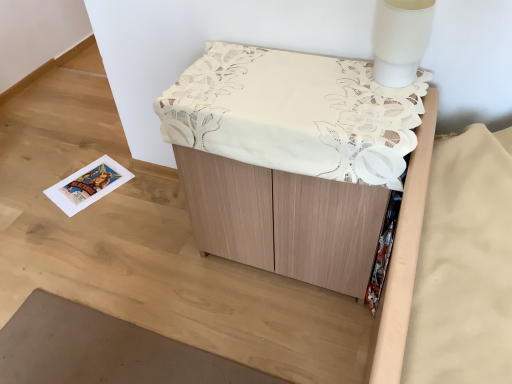
Identify the location of wooden cabinet at center. This screenshot has width=512, height=384. (304, 173).

Describe the element at coordinates (304, 173) in the screenshot. The width and height of the screenshot is (512, 384). I see `wooden cabinet at center` at that location.

You are a GUI agent. You are given a task and a screenshot of the screen. Output one action in this format:
    pyautogui.click(x=<x>, y=<y>)
    Task: Click on the white matte table lamp at upper right
    The image size is (512, 384).
    Given the screenshot: What is the action you would take?
    pyautogui.click(x=400, y=39)

The width and height of the screenshot is (512, 384). What do you see at coordinates (400, 39) in the screenshot?
I see `white matte table lamp at upper right` at bounding box center [400, 39].

The width and height of the screenshot is (512, 384). In order to click on wooden cabinet at center in this screenshot , I will do `click(304, 173)`.

Which object is positioned more to the left, white matte table lamp at upper right or wooden cabinet at center?

wooden cabinet at center is more to the left.

Relative to wooden cabinet at center, is white matte table lamp at upper right in front or behind?

white matte table lamp at upper right is positioned farther from the viewer than wooden cabinet at center.

Which is in front, point (409, 79) or point (256, 106)?

Point (256, 106)

From the image's perspective, between white matte table lamp at upper right and wooden cabinet at center, which one is located above?

white matte table lamp at upper right appears higher in the image.

From a real-world perspective, relative to wooden cabinet at center, is white matte table lamp at upper right vertically above or below?

Clearly, from a real-world perspective, white matte table lamp at upper right is above wooden cabinet at center.

Is white matte table lamp at upper right thinner than wooden cabinet at center?

Yes, white matte table lamp at upper right is thinner than wooden cabinet at center.

Who is shorter, white matte table lamp at upper right or wooden cabinet at center?

white matte table lamp at upper right is shorter.

Considering the sizes of white matte table lamp at upper right and wooden cabinet at center in the image, is white matte table lamp at upper right bigger or smaller than wooden cabinet at center?

Clearly, white matte table lamp at upper right is smaller in size than wooden cabinet at center.

Is white matte table lamp at upper right inside the boundaries of wooden cabinet at center, or outside?

white matte table lamp at upper right is spatially situated outside wooden cabinet at center.

Would you say white matte table lamp at upper right is a long distance from wooden cabinet at center?

No, white matte table lamp at upper right is in close proximity to wooden cabinet at center.

Is white matte table lamp at upper right oriented away from wooden cabinet at center?

No, wooden cabinet at center is not at the back of white matte table lamp at upper right.

What's the angular difference between white matte table lamp at upper right and wooden cabinet at center's facing directions?

The facing directions of white matte table lamp at upper right and wooden cabinet at center are 0.485 degrees apart.

How much distance is there between white matte table lamp at upper right and wooden cabinet at center?

12.82 inches.

Locate an element on the screen. This screenshot has height=384, width=512. furniture in front of the white matte table lamp at upper right is located at coordinates (304, 173).

Is wooden cabinet at center to the left of white matte table lamp at upper right from the viewer's perspective?

Yes, wooden cabinet at center is to the left of white matte table lamp at upper right.

Considering the relative positions of wooden cabinet at center and white matte table lamp at upper right in the image provided, is wooden cabinet at center in front of white matte table lamp at upper right?

Yes, the depth of wooden cabinet at center is less than that of white matte table lamp at upper right.

Considering the points (250, 126) and (405, 25), which point is in front, point (250, 126) or point (405, 25)?

The point (405, 25) is in front.

From the image's perspective, between wooden cabinet at center and white matte table lamp at upper right, who is located below?

wooden cabinet at center is shown below in the image.

From a real-world perspective, who is located higher, wooden cabinet at center or white matte table lamp at upper right?

white matte table lamp at upper right.

Can you confirm if wooden cabinet at center is thinner than white matte table lamp at upper right?

In fact, wooden cabinet at center might be wider than white matte table lamp at upper right.

Which of these two, wooden cabinet at center or white matte table lamp at upper right, stands taller?

With more height is wooden cabinet at center.

In the scene shown: Who is smaller, wooden cabinet at center or white matte table lamp at upper right?

With smaller size is white matte table lamp at upper right.

Which is correct: wooden cabinet at center is inside white matte table lamp at upper right, or outside of it?

wooden cabinet at center exists outside the volume of white matte table lamp at upper right.

In the scene shown: Is wooden cabinet at center not near white matte table lamp at upper right?

wooden cabinet at center is near white matte table lamp at upper right, not far away.

Is wooden cabinet at center oriented towards white matte table lamp at upper right?

No, wooden cabinet at center does not turn towards white matte table lamp at upper right.

The height and width of the screenshot is (384, 512). I want to click on furniture that is below the white matte table lamp at upper right (from the image's perspective), so click(304, 173).

Where is `furniture below the white matte table lamp at upper right (from the image's perspective)`? The width and height of the screenshot is (512, 384). furniture below the white matte table lamp at upper right (from the image's perspective) is located at coordinates (304, 173).

Find the location of a particular element. The height and width of the screenshot is (384, 512). table lamp behind the wooden cabinet at center is located at coordinates pos(400,39).